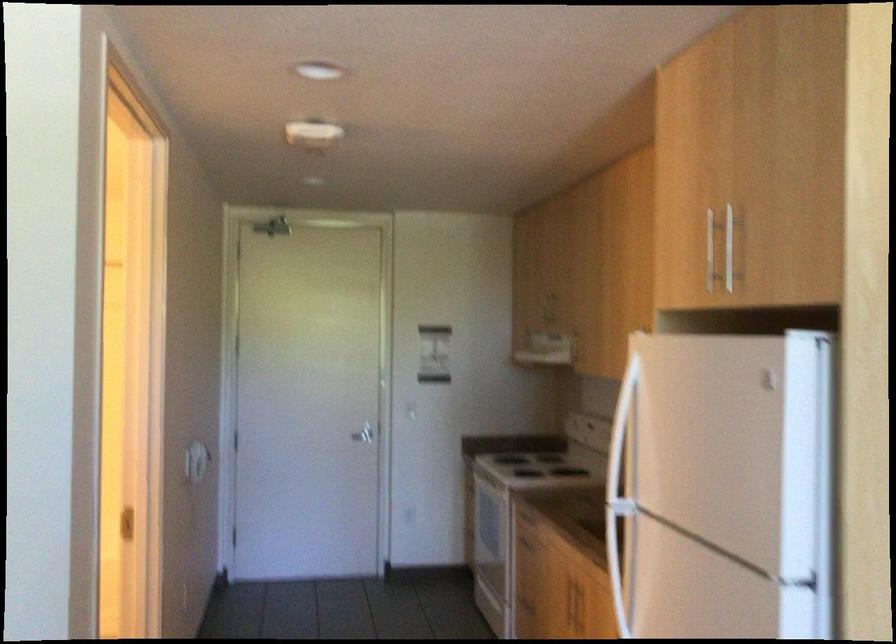
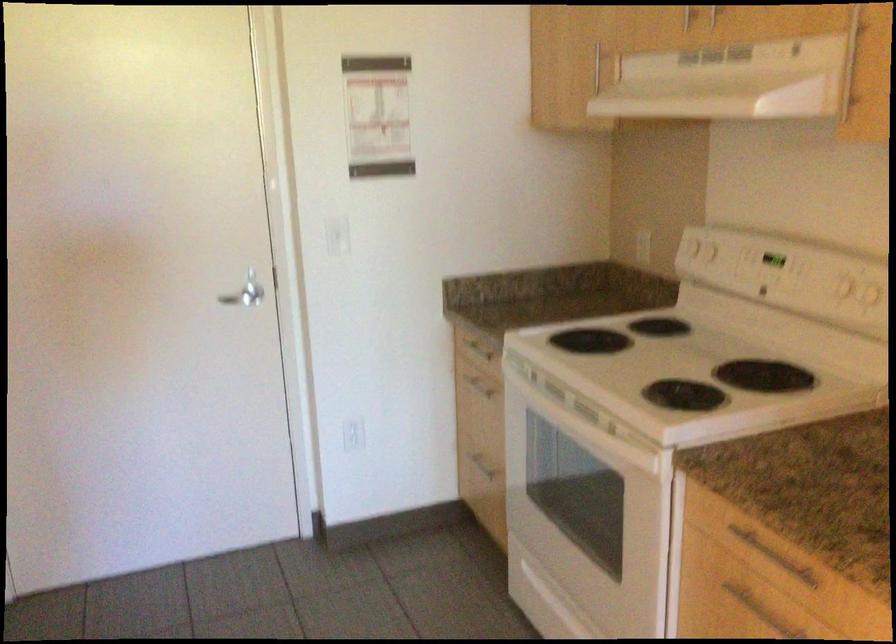
Find the pixel in the second image that matches the point at 562,299 in the first image.

(714, 15)